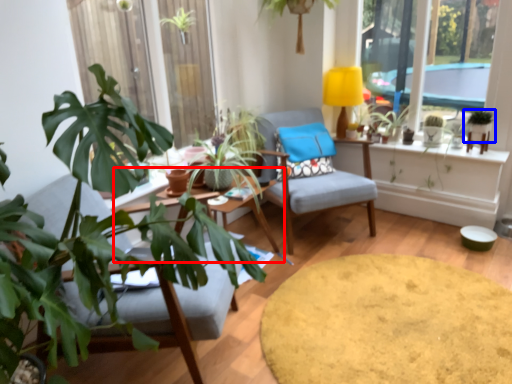
Question: Among these objects, which one is nearest to the camera, round table (highlighted by a red box) or houseplant (highlighted by a blue box)?

Choices:
 (A) round table
 (B) houseplant

Answer: (A)